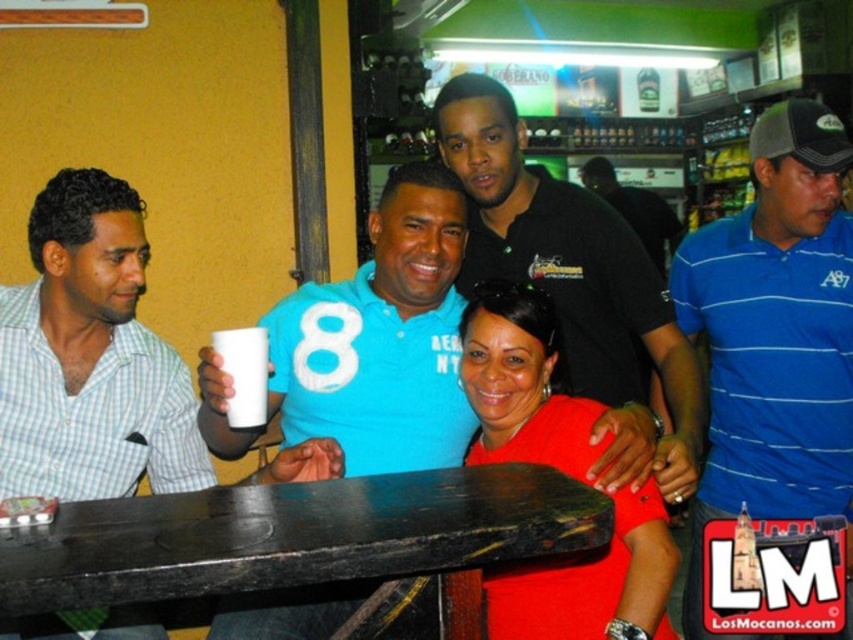
Which is below, black matte table at center or blue striped polo shirt at center?

black matte table at center

Can you confirm if black matte table at center is bigger than blue striped polo shirt at center?

Incorrect, black matte table at center is not larger than blue striped polo shirt at center.

Describe the element at coordinates (302, 538) in the screenshot. The height and width of the screenshot is (640, 853). I see `black matte table at center` at that location.

Image resolution: width=853 pixels, height=640 pixels. Find the location of `black matte table at center`. black matte table at center is located at coordinates (302, 538).

Can you confirm if black shirt at center is positioned to the right of white fabric number at center?

Correct, you'll find black shirt at center to the right of white fabric number at center.

Between point (509, 108) and point (308, 358), which one is positioned behind?

The point (509, 108) is behind.

Where is `black shirt at center`? black shirt at center is located at coordinates (576, 285).

Identify the location of black shirt at center. This screenshot has height=640, width=853. (576, 285).

In the scene shown: Can you confirm if white fabric number at center is smaller than matte black shirt at center?

Correct, white fabric number at center occupies less space than matte black shirt at center.

Where is `white fabric number at center`? Image resolution: width=853 pixels, height=640 pixels. white fabric number at center is located at coordinates (326, 346).